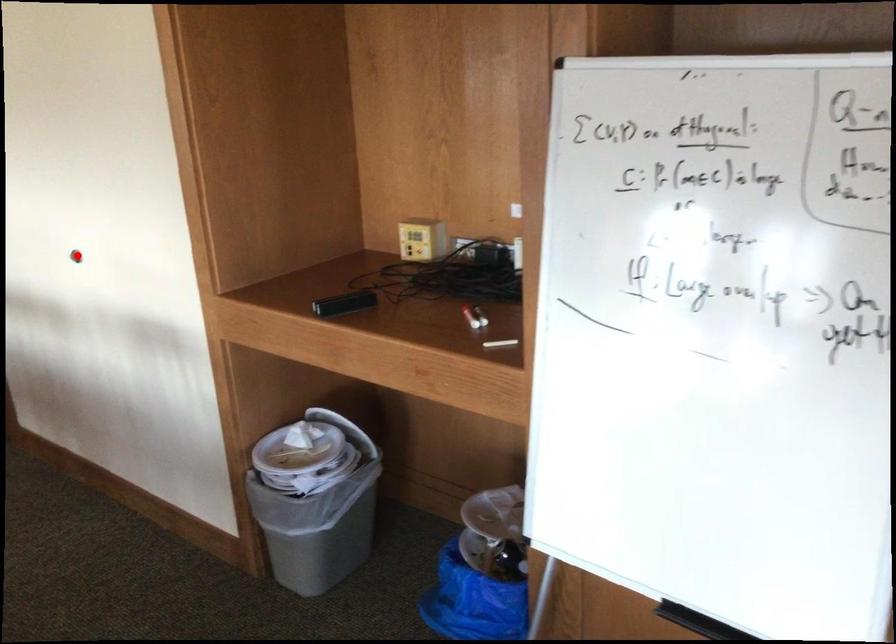
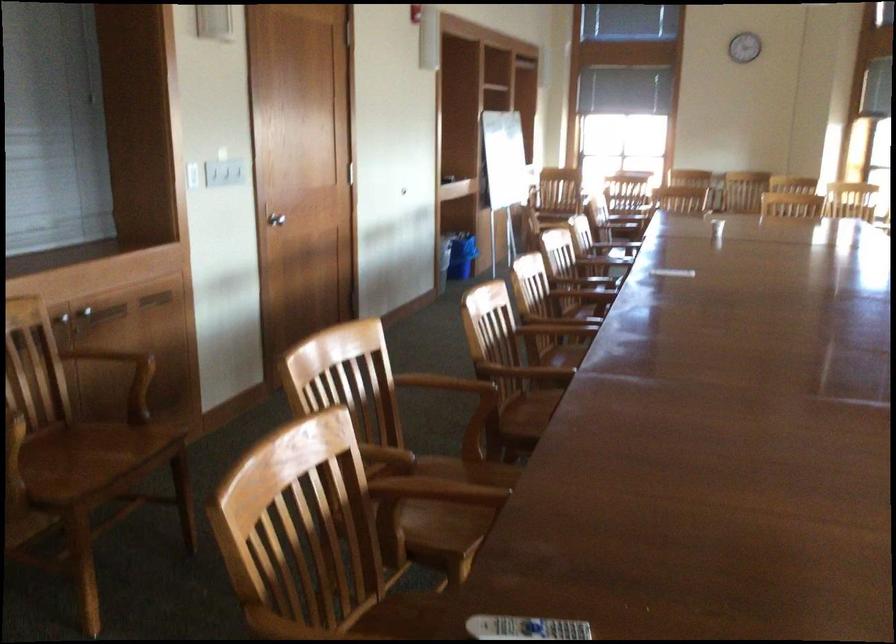
Question: I am providing you with two images of the same scene from different viewpoints. A red point is marked on the first image. Can you still see the location of the red point in image 2?

Choices:
 (A) Yes
 (B) No

Answer: (B)